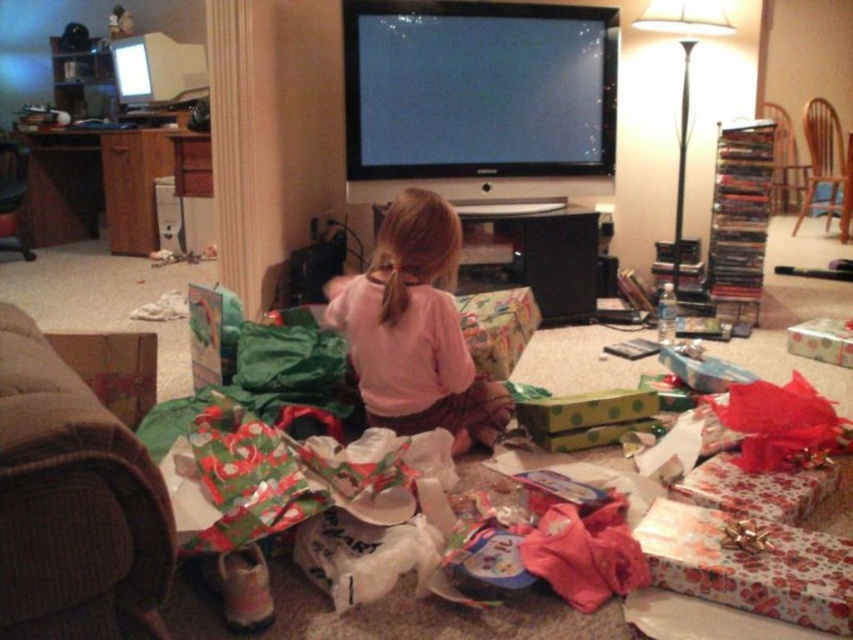
Does brown fabric couch at left have a greater height compared to brown fabric armchair at left?

No, brown fabric couch at left is not taller than brown fabric armchair at left.

Can you confirm if brown fabric couch at left is smaller than brown fabric armchair at left?

Actually, brown fabric couch at left might be larger than brown fabric armchair at left.

Is point (33, 509) in front of point (4, 211)?

Yes, it is in front of point (4, 211).

Identify the location of brown fabric couch at left. (73, 504).

Based on the photo, is pink cotton shirt at center below brown wood chair at upper right?

Yes, pink cotton shirt at center is below brown wood chair at upper right.

Is point (453, 392) farther from camera compared to point (802, 193)?

No, it is not.

Locate an element on the screen. This screenshot has width=853, height=640. pink cotton shirt at center is located at coordinates (415, 330).

Which is in front, point (454, 444) or point (827, 164)?

Point (454, 444) is in front.

The height and width of the screenshot is (640, 853). What do you see at coordinates (415, 330) in the screenshot?
I see `pink cotton shirt at center` at bounding box center [415, 330].

This screenshot has height=640, width=853. I want to click on pink cotton shirt at center, so click(415, 330).